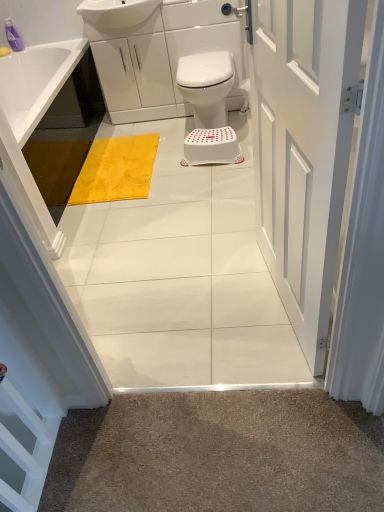
Question: Does white painted wood door at center lie in front of yellow plush bath mat at center?

Choices:
 (A) no
 (B) yes

Answer: (B)

Question: Does white painted wood door at center have a lesser height compared to yellow plush bath mat at center?

Choices:
 (A) yes
 (B) no

Answer: (B)

Question: Is white painted wood door at center at the left side of yellow plush bath mat at center?

Choices:
 (A) yes
 (B) no

Answer: (B)

Question: Is white painted wood door at center far away from yellow plush bath mat at center?

Choices:
 (A) yes
 (B) no

Answer: (A)

Question: Is white painted wood door at center not within yellow plush bath mat at center?

Choices:
 (A) yes
 (B) no

Answer: (A)

Question: Based on their sizes in the image, would you say yellow plush bath mat at center is bigger or smaller than white plastic bidet at center?

Choices:
 (A) small
 (B) big

Answer: (A)

Question: In the image, is yellow plush bath mat at center on the left side or the right side of white plastic bidet at center?

Choices:
 (A) right
 (B) left

Answer: (B)

Question: Considering the positions of point (117, 151) and point (195, 116), is point (117, 151) closer or farther from the camera than point (195, 116)?

Choices:
 (A) closer
 (B) farther

Answer: (A)

Question: Relative to white plastic bidet at center, is yellow plush bath mat at center in front or behind?

Choices:
 (A) front
 (B) behind

Answer: (B)

Question: From the image's perspective, relative to white painted wood door at center, is translucent purple bottle at upper left above or below?

Choices:
 (A) below
 (B) above

Answer: (B)

Question: Is point (19, 50) positioned closer to the camera than point (266, 195)?

Choices:
 (A) closer
 (B) farther

Answer: (B)

Question: From a real-world perspective, relative to white painted wood door at center, is translucent purple bottle at upper left vertically above or below?

Choices:
 (A) below
 (B) above

Answer: (B)

Question: Considering the positions of translucent purple bottle at upper left and white painted wood door at center in the image, is translucent purple bottle at upper left wider or thinner than white painted wood door at center?

Choices:
 (A) thin
 (B) wide

Answer: (A)

Question: Considering the positions of white painted wood door at center and white plastic stool at center in the image, is white painted wood door at center wider or thinner than white plastic stool at center?

Choices:
 (A) thin
 (B) wide

Answer: (A)

Question: Considering the positions of point (329, 38) and point (208, 153), is point (329, 38) closer or farther from the camera than point (208, 153)?

Choices:
 (A) farther
 (B) closer

Answer: (B)